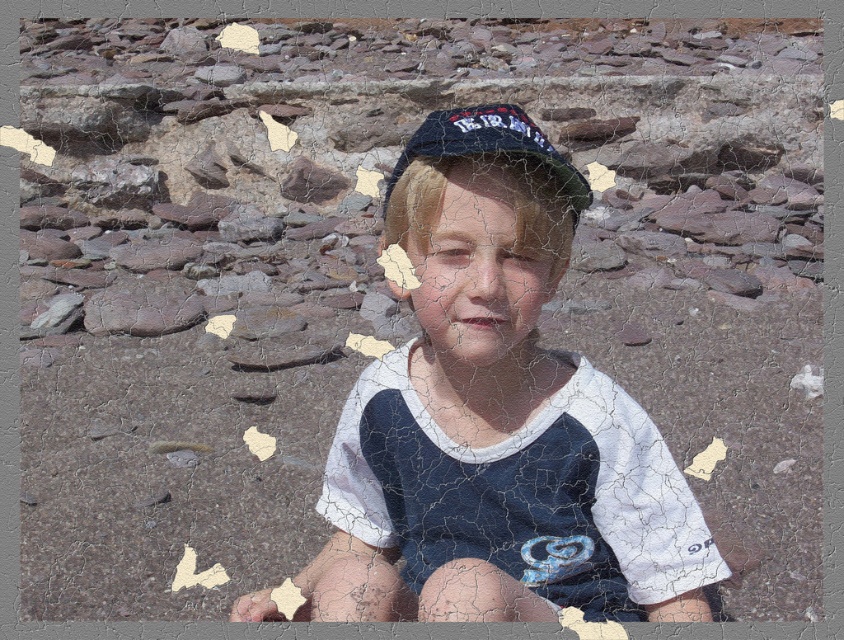
Question: Is white mesh shirt at center positioned before dark blue fabric baseball hat at center?

Choices:
 (A) yes
 (B) no

Answer: (A)

Question: In this image, where is white mesh shirt at center located relative to dark blue fabric baseball hat at center?

Choices:
 (A) left
 (B) right

Answer: (B)

Question: Which of the following is the closest to the observer?

Choices:
 (A) white mesh shirt at center
 (B) dark blue fabric baseball hat at center

Answer: (A)

Question: Can you confirm if white mesh shirt at center is positioned to the right of dark blue fabric baseball hat at center?

Choices:
 (A) yes
 (B) no

Answer: (A)